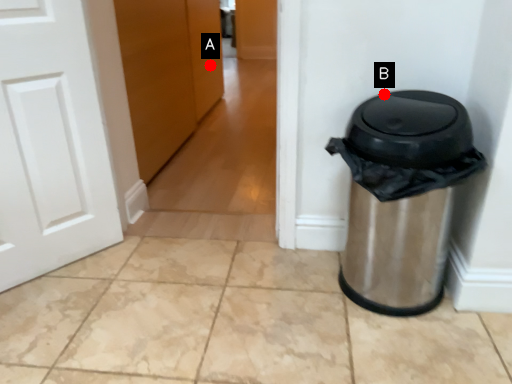
Question: Two points are circled on the image, labeled by A and B beside each circle. Which of the following is the closest to the observer?

Choices:
 (A) A is closer
 (B) B is closer

Answer: (B)